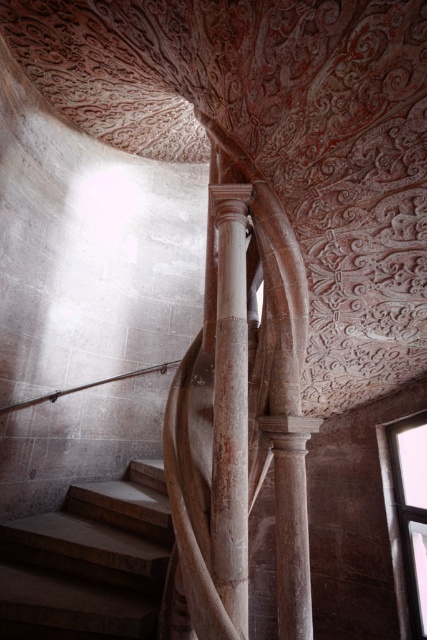
Which is more to the left, smooth stone stairs at center or satin silver railing at upper center?

satin silver railing at upper center

Is point (26, 520) more distant than point (34, 400)?

No, (26, 520) is closer to viewer.

Is point (146, 490) positioned before point (79, 387)?

Yes, point (146, 490) is closer to viewer.

I want to click on smooth stone stairs at center, so click(x=90, y=561).

Is smooth stone column at center taller than satin silver railing at upper center?

Yes.

I want to click on smooth stone column at center, so click(x=231, y=404).

Does smooth stone stairs at center come behind smooth stone column at center?

Yes.

Is smooth stone stairs at center smaller than smooth stone column at center?

No.

Who is more distant from viewer, (29, 548) or (215, 481)?

The point (29, 548) is more distant.

The width and height of the screenshot is (427, 640). I want to click on smooth stone stairs at center, so click(x=90, y=561).